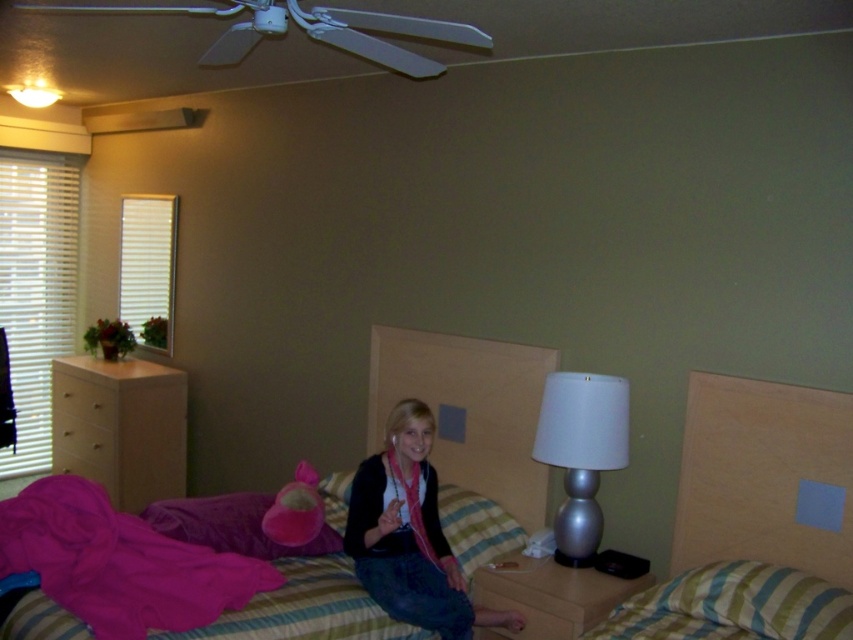
Does velvet pink blanket at lower left have a smaller size compared to pink fabric at center?

No.

The width and height of the screenshot is (853, 640). Find the location of `velvet pink blanket at lower left`. velvet pink blanket at lower left is located at coordinates (119, 563).

Who is more distant from viewer, [76,502] or [422,589]?

Positioned behind is point [422,589].

Locate an element on the screen. The width and height of the screenshot is (853, 640). velvet pink blanket at lower left is located at coordinates (119, 563).

Is point (434, 474) closer to viewer compared to point (543, 397)?

No.

From the picture: Who is more distant from viewer, (x=425, y=528) or (x=566, y=458)?

The point (x=425, y=528) is more distant.

Does point (440, 566) lie in front of point (563, 452)?

No, it is behind (563, 452).

This screenshot has width=853, height=640. Find the location of `pink fabric at center`. pink fabric at center is located at coordinates (410, 534).

Based on the photo, is wooden dresser at left shorter than silver metallic lamp at right?

In fact, wooden dresser at left may be taller than silver metallic lamp at right.

Does wooden dresser at left have a smaller size compared to silver metallic lamp at right?

No.

In order to click on wooden dresser at left in this screenshot , I will do `click(120, 428)`.

The height and width of the screenshot is (640, 853). What are the coordinates of `wooden dresser at left` in the screenshot? It's located at (120, 428).